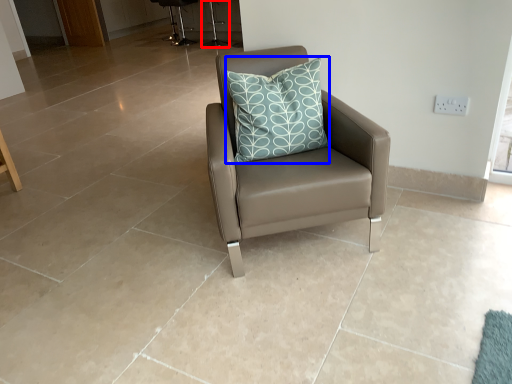
Question: Among these objects, which one is nearest to the camera, bar stool (highlighted by a red box) or pillow (highlighted by a blue box)?

Choices:
 (A) bar stool
 (B) pillow

Answer: (B)